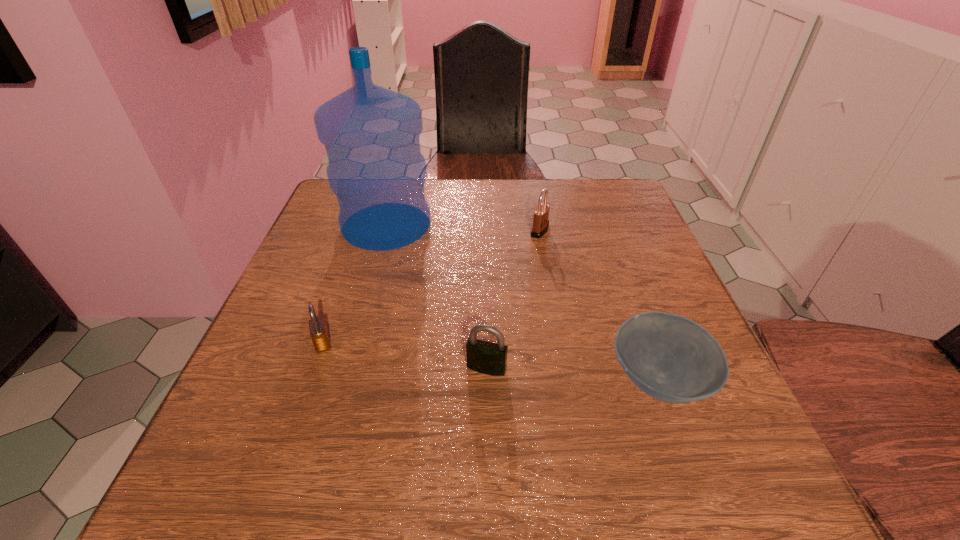
Locate an element on the screen. The image size is (960, 540). the tallest object is located at coordinates (371, 134).

In order to click on the second object from right to left in this screenshot , I will do `click(541, 214)`.

Where is `the rightmost padlock`? The height and width of the screenshot is (540, 960). the rightmost padlock is located at coordinates (541, 214).

At what (x,y) coordinates should I click in order to perform the action: click on the nearest padlock. Please return your answer as a coordinate pair (x, y). This screenshot has width=960, height=540. Looking at the image, I should click on (485, 357).

At what (x,y) coordinates should I click in order to perform the action: click on the second padlock from right to left. Please return your answer as a coordinate pair (x, y). Image resolution: width=960 pixels, height=540 pixels. Looking at the image, I should click on (485, 357).

This screenshot has width=960, height=540. What are the coordinates of `the second nearest padlock` in the screenshot? It's located at (318, 331).

Identify the location of the shortest object. This screenshot has height=540, width=960. (669, 357).

Identify the location of the rightmost object. (669, 357).

I want to click on free spot located on the right of the water jug, so click(x=525, y=225).

This screenshot has height=540, width=960. I want to click on vacant space located 0.230m on the left of the second object from right to left, so click(x=434, y=231).